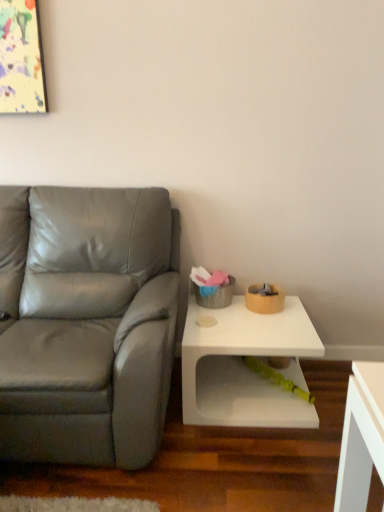
Question: Considering the relative sizes of matte gray leather couch at left and rubberized green toy at lower center in the image provided, is matte gray leather couch at left smaller than rubberized green toy at lower center?

Choices:
 (A) yes
 (B) no

Answer: (B)

Question: Would you say matte gray leather couch at left is outside rubberized green toy at lower center?

Choices:
 (A) no
 (B) yes

Answer: (B)

Question: From a real-world perspective, does matte gray leather couch at left stand above rubberized green toy at lower center?

Choices:
 (A) no
 (B) yes

Answer: (B)

Question: Is matte gray leather couch at left further to the viewer compared to rubberized green toy at lower center?

Choices:
 (A) no
 (B) yes

Answer: (A)

Question: Does matte gray leather couch at left appear on the right side of rubberized green toy at lower center?

Choices:
 (A) no
 (B) yes

Answer: (A)

Question: Is the depth of matte gray leather couch at left less than that of rubberized green toy at lower center?

Choices:
 (A) yes
 (B) no

Answer: (A)

Question: Is rubberized green toy at lower center closer to the viewer compared to white matte table at lower right?

Choices:
 (A) yes
 (B) no

Answer: (B)

Question: Are rubberized green toy at lower center and white matte table at lower right beside each other?

Choices:
 (A) no
 (B) yes

Answer: (A)

Question: Does rubberized green toy at lower center appear on the left side of white matte table at lower right?

Choices:
 (A) no
 (B) yes

Answer: (A)

Question: From the image's perspective, is rubberized green toy at lower center beneath white matte table at lower right?

Choices:
 (A) yes
 (B) no

Answer: (A)

Question: Are rubberized green toy at lower center and white matte table at lower right far apart?

Choices:
 (A) no
 (B) yes

Answer: (A)

Question: Is rubberized green toy at lower center wider than white matte table at lower right?

Choices:
 (A) no
 (B) yes

Answer: (A)

Question: Is white matte table at lower right to the left of rubberized green toy at lower center from the viewer's perspective?

Choices:
 (A) yes
 (B) no

Answer: (A)